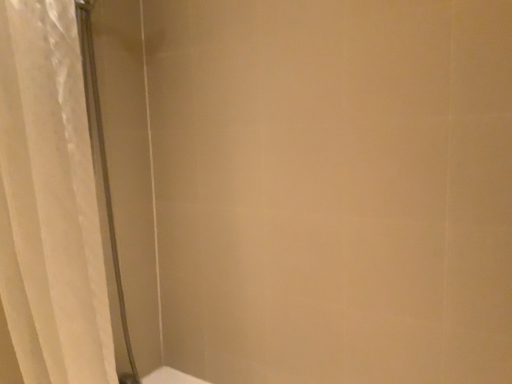
Find the location of `white fabric curtain at left`. white fabric curtain at left is located at coordinates (50, 201).

What do you see at coordinates (50, 201) in the screenshot?
I see `white fabric curtain at left` at bounding box center [50, 201].

The width and height of the screenshot is (512, 384). I want to click on white fabric curtain at left, so click(x=50, y=201).